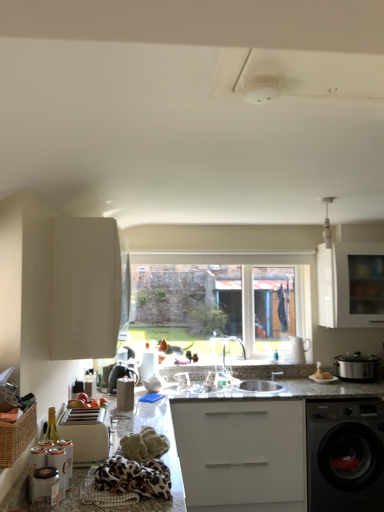
Question: Is matte silver pot at right oriented away from white glossy cabinet at upper right, the first cabinetry when ordered from right to left?

Choices:
 (A) yes
 (B) no

Answer: (B)

Question: From the image's perspective, would you say matte silver pot at right is shown under white glossy cabinet at upper right, the second cabinetry in the front-to-back sequence?

Choices:
 (A) no
 (B) yes

Answer: (B)

Question: Does matte silver pot at right have a larger size compared to white glossy cabinet at upper right, the first cabinetry when ordered from right to left?

Choices:
 (A) yes
 (B) no

Answer: (B)

Question: From the image's perspective, does matte silver pot at right appear higher than white glossy cabinet at upper right, the first cabinetry when ordered from right to left?

Choices:
 (A) yes
 (B) no

Answer: (B)

Question: Considering the relative sizes of matte silver pot at right and white glossy cabinet at upper right, the second cabinetry in the front-to-back sequence, in the image provided, is matte silver pot at right wider than white glossy cabinet at upper right, the second cabinetry in the front-to-back sequence,?

Choices:
 (A) yes
 (B) no

Answer: (B)

Question: From a real-world perspective, is matte silver pot at right under white glossy cabinet at upper right, the first cabinetry when ordered from right to left?

Choices:
 (A) yes
 (B) no

Answer: (A)

Question: Does black metallic washing machine at lower right come behind metallic silver canister at lower left, which is the second appliance in back-to-front order?

Choices:
 (A) no
 (B) yes

Answer: (B)

Question: Does black metallic washing machine at lower right have a greater height compared to metallic silver canister at lower left, which is counted as the 1th appliance, starting from the front?

Choices:
 (A) yes
 (B) no

Answer: (A)

Question: Does black metallic washing machine at lower right appear on the right side of metallic silver canister at lower left, which is the second appliance in back-to-front order?

Choices:
 (A) yes
 (B) no

Answer: (A)

Question: Is black metallic washing machine at lower right bigger than metallic silver canister at lower left, which is counted as the 1th appliance, starting from the front?

Choices:
 (A) no
 (B) yes

Answer: (B)

Question: Can we say black metallic washing machine at lower right lies outside metallic silver canister at lower left, which is counted as the 1th appliance, starting from the front?

Choices:
 (A) no
 (B) yes

Answer: (B)

Question: Does black metallic washing machine at lower right have a lesser height compared to metallic silver canister at lower left, which is counted as the 1th appliance, starting from the front?

Choices:
 (A) yes
 (B) no

Answer: (B)

Question: Can you confirm if woven brown basket at lower left is smaller than silver metallic tap at center?

Choices:
 (A) no
 (B) yes

Answer: (B)